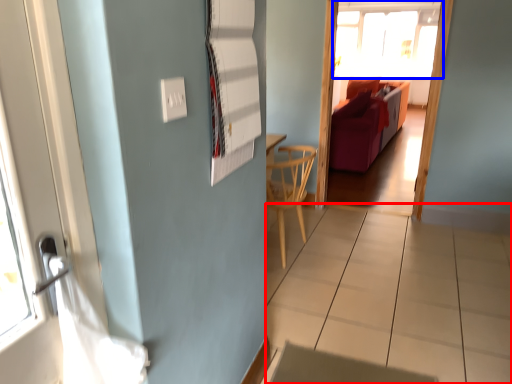
Question: Which object appears farthest to the camera in this image, tile (highlighted by a red box) or window (highlighted by a blue box)?

Choices:
 (A) tile
 (B) window

Answer: (B)